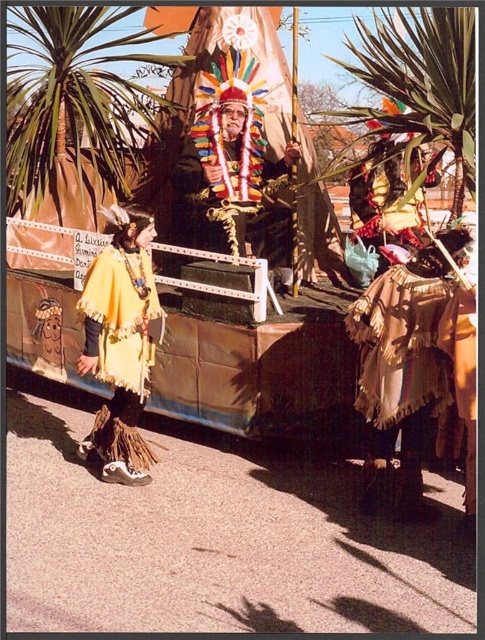
Question: Among these objects, which one is nearest to the camera?

Choices:
 (A) green leafy palm tree at upper left
 (B) yellow fringed cape at lower left
 (C) green leafy palm tree at upper right
 (D) multicolored feather headdress at center

Answer: (C)

Question: Which of these objects is positioned farthest from the green leafy palm tree at upper left?

Choices:
 (A) yellow fabric headdress at center
 (B) multicolored feather headdress at center
 (C) green leafy palm tree at upper right

Answer: (C)

Question: Which point is closer to the camera taking this photo?

Choices:
 (A) (221, 68)
 (B) (66, 88)
 (C) (52, 323)
 (D) (155, 227)

Answer: (D)

Question: Where is multicolored feather headdress at center located in relation to yellow fabric headdress at center in the image?

Choices:
 (A) right
 (B) left

Answer: (A)

Question: Can you confirm if yellow fringed cape at lower left is wider than green leafy palm tree at upper right?

Choices:
 (A) no
 (B) yes

Answer: (A)

Question: Is green leafy palm tree at upper left to the left of yellow fabric headdress at center from the viewer's perspective?

Choices:
 (A) no
 (B) yes

Answer: (B)